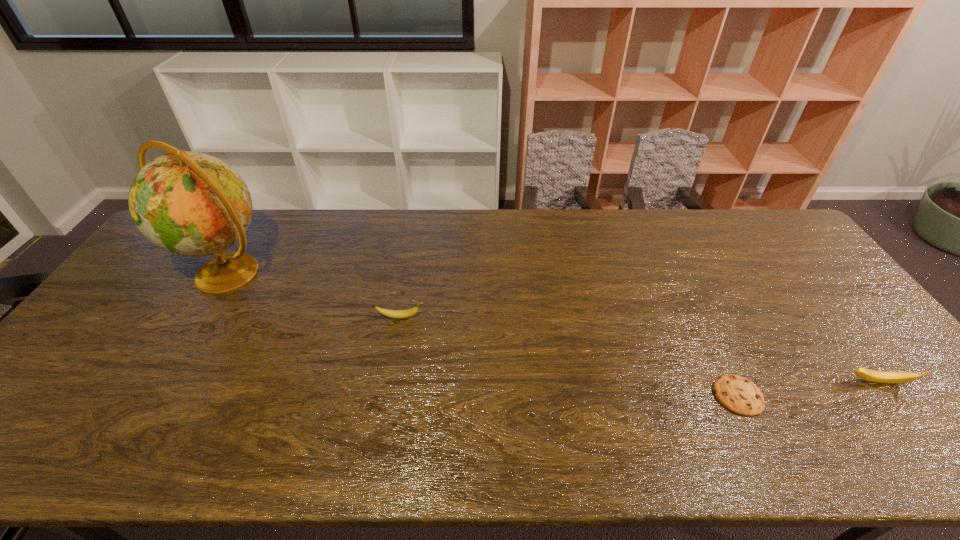
Where is `the closest object to the farther banana`? Image resolution: width=960 pixels, height=540 pixels. the closest object to the farther banana is located at coordinates (191, 204).

Where is `the closest object to the nearer banana`? Image resolution: width=960 pixels, height=540 pixels. the closest object to the nearer banana is located at coordinates (739, 395).

The height and width of the screenshot is (540, 960). Find the location of `vacant space that satisfies the following two spatial constraints: 1. at the stem of the farther banana; 2. on the left side of the shortest object`. vacant space that satisfies the following two spatial constraints: 1. at the stem of the farther banana; 2. on the left side of the shortest object is located at coordinates (387, 395).

Where is `free spot that satisfies the following two spatial constraints: 1. at the stem of the second farthest object; 2. on the left side of the shortest object`? Image resolution: width=960 pixels, height=540 pixels. free spot that satisfies the following two spatial constraints: 1. at the stem of the second farthest object; 2. on the left side of the shortest object is located at coordinates (387, 395).

I want to click on free spot that satisfies the following two spatial constraints: 1. at the stem of the cookie; 2. on the right side of the farther banana, so click(387, 395).

You are a GUI agent. You are given a task and a screenshot of the screen. Output one action in this format:
    pyautogui.click(x=<x>, y=<y>)
    Task: Click on the free point that satisfies the following two spatial constraints: 1. on the back side of the shortest object; 2. at the stem of the second object from left to right
    This screenshot has width=960, height=540.
    Given the screenshot: What is the action you would take?
    pyautogui.click(x=699, y=317)

Identify the location of free region that satisfies the following two spatial constraints: 1. at the stem of the third object from right to left; 2. on the left side of the cookie. The height and width of the screenshot is (540, 960). (387, 395).

The height and width of the screenshot is (540, 960). I want to click on free spot that satisfies the following two spatial constraints: 1. at the stem of the left banana; 2. on the back side of the shortest object, so click(387, 395).